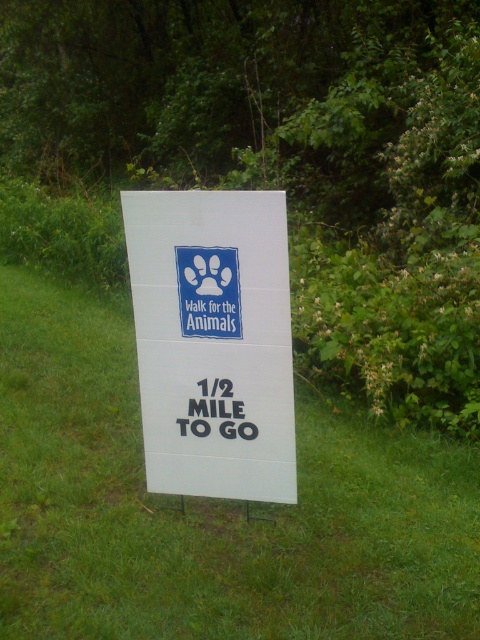
Question: Among these objects, which one is nearest to the camera?

Choices:
 (A) white cardboard sign at center
 (B) green grass at center

Answer: (B)

Question: Does green grass at center have a smaller size compared to white cardboard sign at center?

Choices:
 (A) yes
 (B) no

Answer: (B)

Question: From the image, what is the correct spatial relationship of green grass at center in relation to white cardboard sign at center?

Choices:
 (A) left
 (B) right

Answer: (A)

Question: Among these points, which one is farthest from the camera?

Choices:
 (A) (158, 328)
 (B) (264, 531)

Answer: (B)

Question: Among these objects, which one is nearest to the camera?

Choices:
 (A) white cardboard sign at center
 (B) green grass at center

Answer: (B)

Question: Does green grass at center appear over white cardboard sign at center?

Choices:
 (A) yes
 (B) no

Answer: (B)